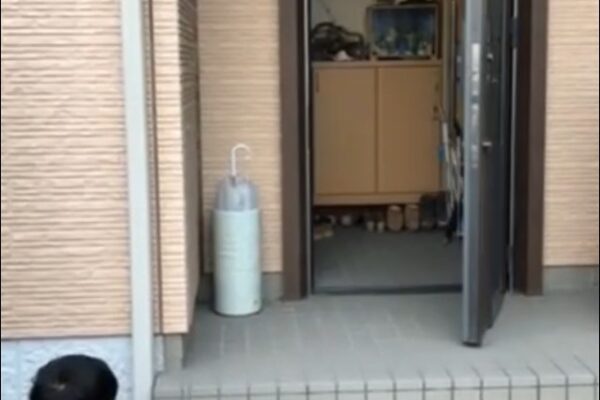
Identify the location of beige drawer. (371, 129).